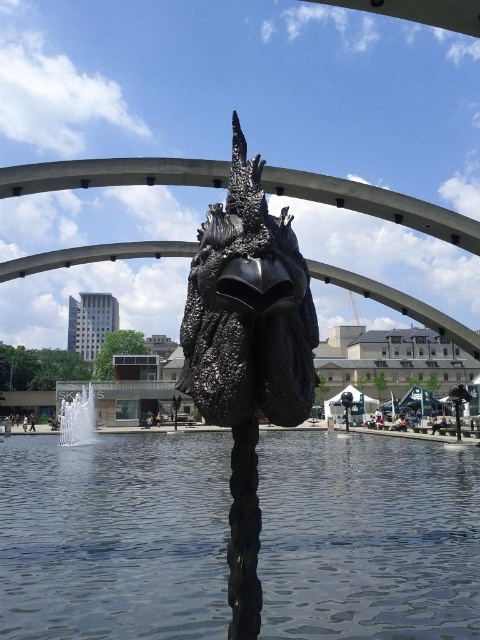
You are a city planner assessing the space between the transparent glass water at center and the black textured sculpture at center. Given that the sculpture is part of the water feature, can you determine which one is wider?

The transparent glass water at center is wider than the black textured sculpture at center according to the description.